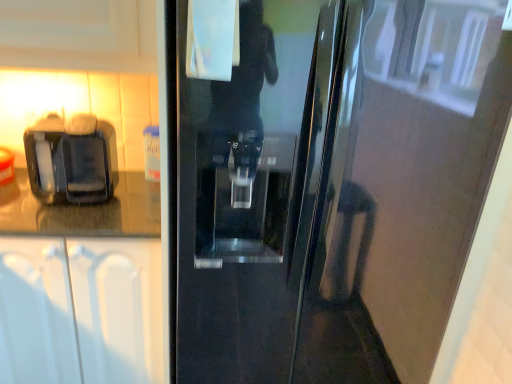
Identify the location of free space above white matte cabinet at left (from a real-world perspective). (75, 208).